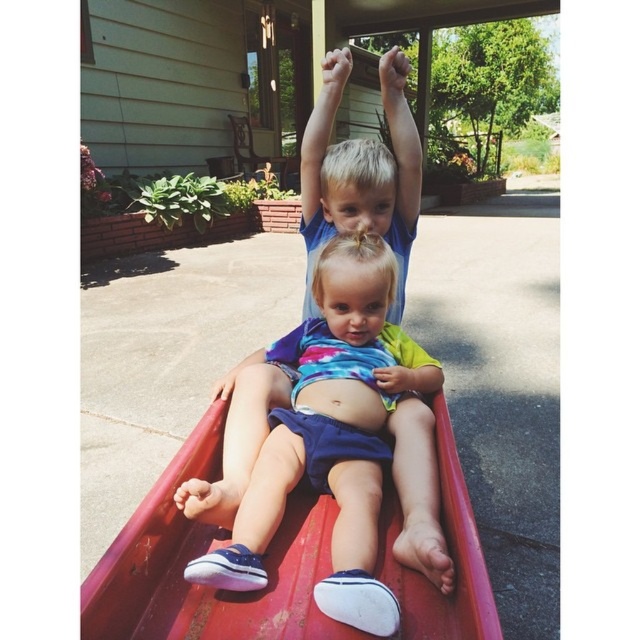
You are a parent trying to ensure safety for your children playing in the backyard. You see the matte blue shorts at center and the metallic red slide at center. Which object is bigger and might require more space to avoid collisions?

The matte blue shorts at center is larger in size than the metallic red slide at center, so it might require more space to avoid collisions.

You are standing at point A located at coordinates point (339,438). You want to walk to the wooden chair near the house on the left. Which direction should you move relative to the blue shorts at center?

The point (339,438) is on the matte blue shorts at center. To reach the wooden chair near the house on the left, you should move to the left from the blue shorts at center.

Consider the image. You are a parent trying to take a photo of your children playing. You want to ensure both the matte blue shorts at center and the metallic red slide at center are clearly visible. Which object should you focus on first to ensure depth of field captures both?

You should focus on the matte blue shorts at center first because it is closer to you than the metallic red slide at center. By focusing on the closer object, the slide in the background will still be in acceptable focus due to the depth of field.